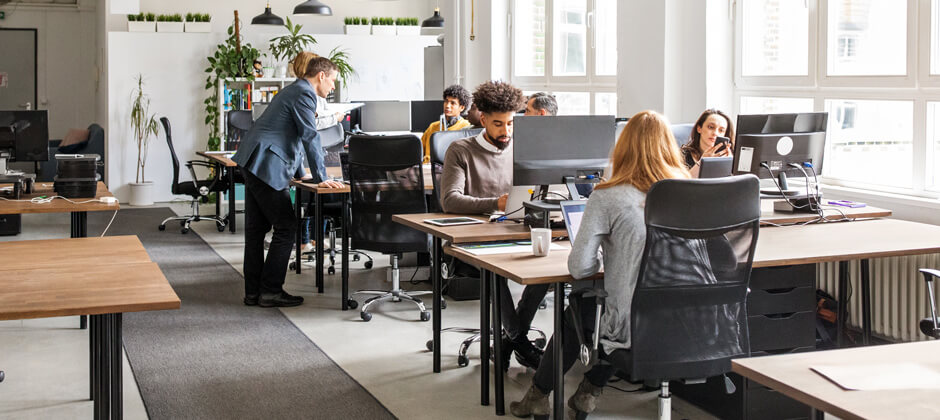
Where is `tables`? tables is located at coordinates (111, 298), (94, 201), (332, 187), (226, 156), (471, 223), (525, 270).